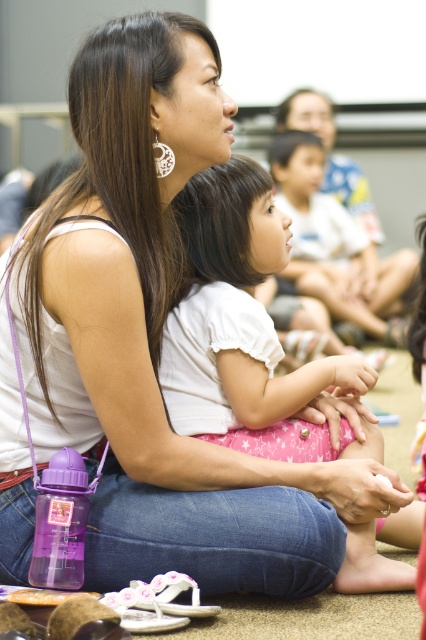
Can you confirm if white cotton shirt at center is positioned to the left of white cotton shirt at upper center?

Yes, white cotton shirt at center is to the left of white cotton shirt at upper center.

This screenshot has width=426, height=640. I want to click on white cotton shirt at center, so click(x=244, y=330).